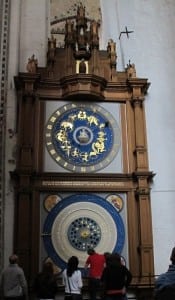
Find the location of a particular element. Image resolution: width=175 pixels, height=300 pixels. tapestry is located at coordinates (96, 8).